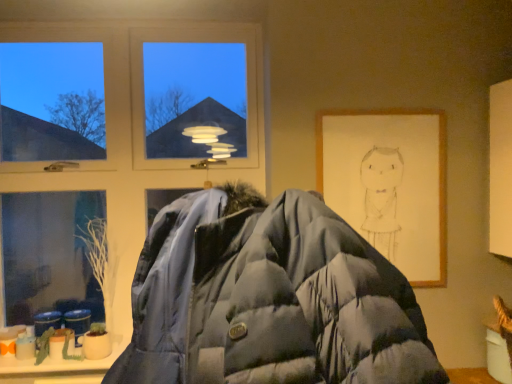
Question: From their relative heights in the image, would you say matte blue puffer jacket at center is taller or shorter than transparent glass window at upper left?

Choices:
 (A) tall
 (B) short

Answer: (B)

Question: Does point (138, 316) appear closer or farther from the camera than point (81, 167)?

Choices:
 (A) closer
 (B) farther

Answer: (A)

Question: Based on their relative distances, which object is farther from the wooden framed drawing at right?

Choices:
 (A) transparent glass window at upper left
 (B) matte blue puffer jacket at center

Answer: (B)

Question: Based on their relative distances, which object is farther from the transparent glass window at upper left?

Choices:
 (A) matte blue puffer jacket at center
 (B) wooden framed drawing at right

Answer: (A)